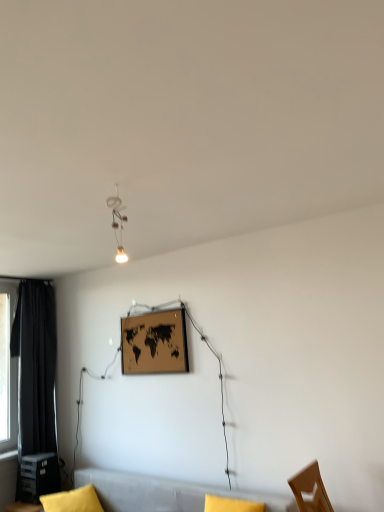
Question: From a real-world perspective, is yellow fabric pillow at lower left above or below black fabric curtain at left?

Choices:
 (A) above
 (B) below

Answer: (B)

Question: Is yellow fabric pillow at lower left taller or shorter than black fabric curtain at left?

Choices:
 (A) short
 (B) tall

Answer: (A)

Question: Based on their relative distances, which object is farther from the matte white lamp at upper center?

Choices:
 (A) black fabric curtain at left
 (B) matte black plastic table at lower left
 (C) wooden map at center
 (D) yellow fabric pillow at lower left
 (E) soft gray couch at lower center

Answer: (B)

Question: Which is farther from the wooden map at center?

Choices:
 (A) matte black plastic table at lower left
 (B) black fabric curtain at left
 (C) yellow fabric pillow at lower left
 (D) matte white lamp at upper center
 (E) soft gray couch at lower center

Answer: (A)